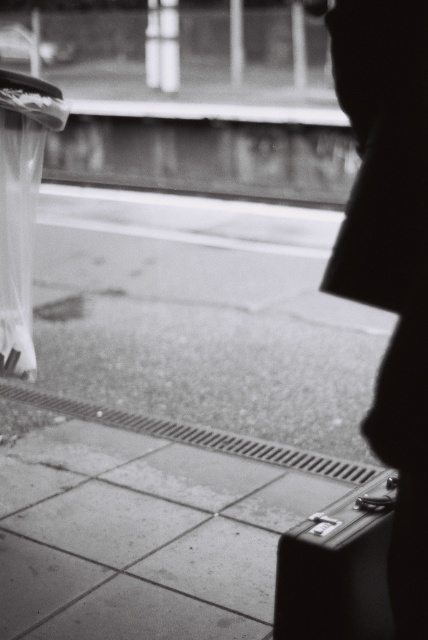
You are standing at the center of the train station platform and want to retrieve your metallic suitcase at lower right. Based on the coordinates provided, in which direction should you move to reach it?

The metallic suitcase at lower right is located at coordinates point (x=338, y=568), so you should move towards the lower right direction to reach it.

You are standing at the train station platform in the image. You notice two points marked on the pavement. The first point is at coordinates point [314,568], and the second point is at point [23,346]. Which point is closer to you if you are facing the platform?

A: Point [314,568] is in front of point [23,346], so it is closer to you when facing the platform.

You are a traveler who just arrived at the train station. You see a metallic suitcase at lower right and a transparent nylon umbrella at left. Which object takes up more space in the image?

The transparent nylon umbrella at left occupies more space than the metallic suitcase at lower right.